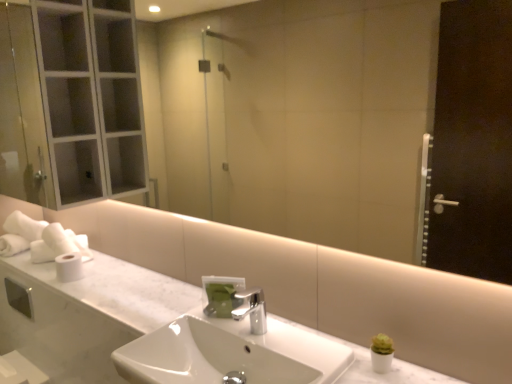
Measure the distance between point (162, 349) and camera.

The depth of point (162, 349) is 4.21 feet.

This screenshot has width=512, height=384. What do you see at coordinates (58, 244) in the screenshot?
I see `white matte toilet paper at left, marked as the 2th toilet paper in a front-to-back arrangement` at bounding box center [58, 244].

Where is `white marble counter top at center`? white marble counter top at center is located at coordinates (88, 314).

Which object is more forward, white matte toilet paper at left, marked as the 2th toilet paper in a front-to-back arrangement, or polished metallic faucet at center?

polished metallic faucet at center is in front.

From a real-world perspective, does white matte toilet paper at left, marked as the 2th toilet paper in a front-to-back arrangement, stand above polished metallic faucet at center?

No.

Does white matte toilet paper at left, the first toilet paper from the back, touch polished metallic faucet at center?

No, white matte toilet paper at left, the first toilet paper from the back, is not next to polished metallic faucet at center.

Is point (33, 248) in front of point (244, 316)?

That is False.

Could white glossy sink at center be considered to be inside green matte soap dispenser at center?

Actually, white glossy sink at center is outside green matte soap dispenser at center.

Which is behind, green matte soap dispenser at center or white glossy sink at center?

green matte soap dispenser at center.

From the picture: Considering the relative sizes of green matte soap dispenser at center and white glossy sink at center in the image provided, is green matte soap dispenser at center shorter than white glossy sink at center?

Correct, green matte soap dispenser at center is not as tall as white glossy sink at center.

How far apart are green matte soap dispenser at center and white glossy sink at center?

green matte soap dispenser at center is 6.72 inches away from white glossy sink at center.

Consider the image. Which of these two, white matte toilet paper at left, marked as the 2th toilet paper in a front-to-back arrangement, or white marble counter top at center, is thinner?

white matte toilet paper at left, marked as the 2th toilet paper in a front-to-back arrangement.

Between white matte toilet paper at left, the first toilet paper from the back, and white marble counter top at center, which one is positioned behind?

white matte toilet paper at left, the first toilet paper from the back, is further away from the camera.

Is white matte toilet paper at left, marked as the 2th toilet paper in a front-to-back arrangement, bigger or smaller than white marble counter top at center?

In the image, white matte toilet paper at left, marked as the 2th toilet paper in a front-to-back arrangement, appears to be smaller than white marble counter top at center.

From the image's perspective, which object appears higher, white marble counter top at center or white glossy sink at center?

white marble counter top at center appears higher in the image.

From a real-world perspective, is white marble counter top at center over white glossy sink at center?

Correct, in the physical world, white marble counter top at center is higher than white glossy sink at center.

Would you say white glossy sink at center is part of white marble counter top at center's contents?

No, white glossy sink at center is not surrounded by white marble counter top at center.

From the image's perspective, who appears lower, white marble counter top at center or white matte toilet paper at left, which ranks as the second toilet paper in back-to-front order?

From the image's view, white marble counter top at center is below.

Can we say white marble counter top at center lies outside white matte toilet paper at left, which ranks as the 1th toilet paper in front-to-back order?

Indeed, white marble counter top at center is completely outside white matte toilet paper at left, which ranks as the 1th toilet paper in front-to-back order.

Looking at this image, is white marble counter top at center looking in the opposite direction of white matte toilet paper at left, which ranks as the second toilet paper in back-to-front order?

white marble counter top at center does not have its back to white matte toilet paper at left, which ranks as the second toilet paper in back-to-front order.

Based on the photo, considering the sizes of polished metallic faucet at center and white marble counter top at center in the image, is polished metallic faucet at center taller or shorter than white marble counter top at center?

Considering their sizes, polished metallic faucet at center has more height than white marble counter top at center.

Are polished metallic faucet at center and white marble counter top at center far apart?

No, polished metallic faucet at center is not far away from white marble counter top at center.

Is white marble counter top at center a part of polished metallic faucet at center?

No, white marble counter top at center is not surrounded by polished metallic faucet at center.

Looking at their sizes, would you say polished metallic faucet at center is wider or thinner than white marble counter top at center?

Clearly, polished metallic faucet at center has less width compared to white marble counter top at center.

From a real-world perspective, which is physically above, white matte toilet paper at left, which ranks as the 1th toilet paper in front-to-back order, or white marble counter top at center?

From a 3D spatial view, white matte toilet paper at left, which ranks as the 1th toilet paper in front-to-back order, is above.

In the scene shown: Is white matte toilet paper at left, which ranks as the 1th toilet paper in front-to-back order, facing towards white marble counter top at center?

No, white matte toilet paper at left, which ranks as the 1th toilet paper in front-to-back order, is not aimed at white marble counter top at center.

Between white matte toilet paper at left, which ranks as the second toilet paper in back-to-front order, and white marble counter top at center, which one has smaller size?

white matte toilet paper at left, which ranks as the second toilet paper in back-to-front order, is smaller.

Between white matte toilet paper at left, which ranks as the second toilet paper in back-to-front order, and white marble counter top at center, which one is positioned behind?

white matte toilet paper at left, which ranks as the second toilet paper in back-to-front order, is further from the camera.

Locate an element on the screen. toilet paper that is the 1st object directly below the polished metallic faucet at center (from a real-world perspective) is located at coordinates (58, 244).

Locate an element on the screen. This screenshot has width=512, height=384. soap dispenser that appears above the white glossy sink at center (from a real-world perspective) is located at coordinates (222, 295).

Considering their positions, is green matte soap dispenser at center positioned further to white glossy sink at center than white matte toilet paper at left, which ranks as the 1th toilet paper in front-to-back order?

The object further to white glossy sink at center is white matte toilet paper at left, which ranks as the 1th toilet paper in front-to-back order.

When comparing their distances from white marble counter top at center, does polished metallic faucet at center or white matte toilet paper at left, which ranks as the second toilet paper in back-to-front order, seem further?

polished metallic faucet at center is positioned further to the anchor white marble counter top at center.

From the image, which object appears to be nearer to white marble counter top at center, green matte soap dispenser at center or white matte toilet paper at left, which ranks as the second toilet paper in back-to-front order?

white matte toilet paper at left, which ranks as the second toilet paper in back-to-front order, is positioned closer to the anchor white marble counter top at center.

When comparing their distances from polished metallic faucet at center, does white matte toilet paper at left, which ranks as the 1th toilet paper in front-to-back order, or white matte toilet paper at left, marked as the 2th toilet paper in a front-to-back arrangement, seem further?

The object further to polished metallic faucet at center is white matte toilet paper at left, marked as the 2th toilet paper in a front-to-back arrangement.

Considering their positions, is white matte toilet paper at left, marked as the 2th toilet paper in a front-to-back arrangement, positioned further to polished metallic faucet at center than white marble counter top at center?

white matte toilet paper at left, marked as the 2th toilet paper in a front-to-back arrangement.

Considering their positions, is white matte toilet paper at left, which ranks as the 1th toilet paper in front-to-back order, positioned further to white marble counter top at center than white matte toilet paper at left, marked as the 2th toilet paper in a front-to-back arrangement?

white matte toilet paper at left, marked as the 2th toilet paper in a front-to-back arrangement, is further to white marble counter top at center.

Considering their positions, is white glossy sink at center positioned further to white matte toilet paper at left, the first toilet paper from the back, than white marble counter top at center?

white glossy sink at center is positioned further to the anchor white matte toilet paper at left, the first toilet paper from the back.

Based on their spatial positions, is polished metallic faucet at center or white matte toilet paper at left, the first toilet paper from the back, closer to white marble counter top at center?

white matte toilet paper at left, the first toilet paper from the back, lies closer to white marble counter top at center than the other object.

The height and width of the screenshot is (384, 512). Find the location of `sink located between white marble counter top at center and polished metallic faucet at center in the left-right direction`. sink located between white marble counter top at center and polished metallic faucet at center in the left-right direction is located at coordinates point(230,353).

Find the location of a particular element. Image resolution: width=512 pixels, height=384 pixels. toilet paper between white matte toilet paper at left, marked as the 2th toilet paper in a front-to-back arrangement, and polished metallic faucet at center is located at coordinates click(69, 267).

You are a GUI agent. You are given a task and a screenshot of the screen. Output one action in this format:
    pyautogui.click(x=<x>, y=<y>)
    Task: Click on the toilet paper located between white matte toilet paper at left, the first toilet paper from the back, and green matte soap dispenser at center in the left-right direction
    The height and width of the screenshot is (384, 512).
    Given the screenshot: What is the action you would take?
    pyautogui.click(x=69, y=267)

Image resolution: width=512 pixels, height=384 pixels. I want to click on tap positioned between white glossy sink at center and green matte soap dispenser at center from near to far, so click(252, 310).